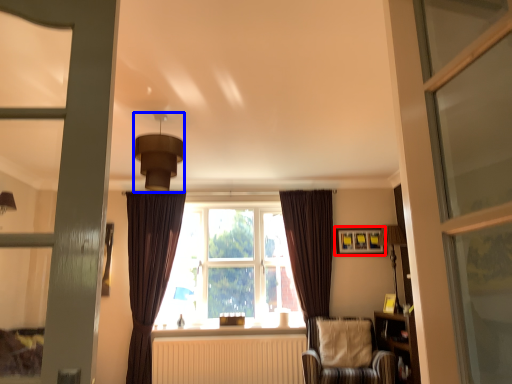
Question: Which object appears farthest to the camera in this image, picture frame (highlighted by a red box) or light fixture (highlighted by a blue box)?

Choices:
 (A) picture frame
 (B) light fixture

Answer: (A)